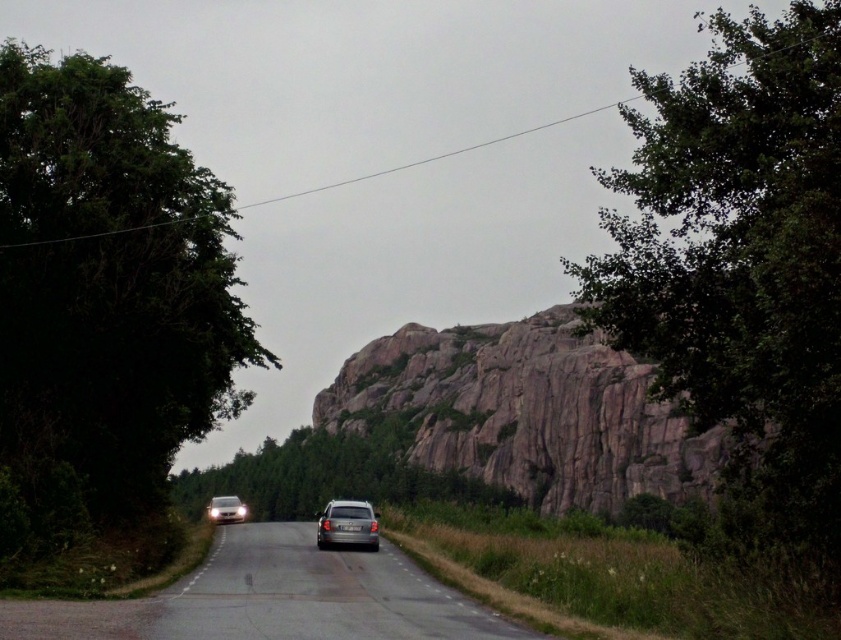
You are a pedestrian standing at the edge of the road. You see a silver metallic car at center and a white matte car at lower left approaching you. Which car is closer to you?

The white matte car at lower left is closer to you because it is only 44.66 meters away from the silver metallic car at center, but since you are at the edge, the white one is nearer.

You are a pedestrian standing at the side of the road. You see the silver metallic car at center and the green leafy tree at center. Which one is closer to the right side of the road?

The silver metallic car at center is to the right of the green leafy tree at center, so it is closer to the right side of the road.

You are a pedestrian standing at the edge of the road. You see the silver metallic car at center and the white matte car at lower left approaching you. Which vehicle is closer to you?

The silver metallic car at center is closer to you because it is in front of the white matte car at lower left, meaning it is nearer in the line of sight.